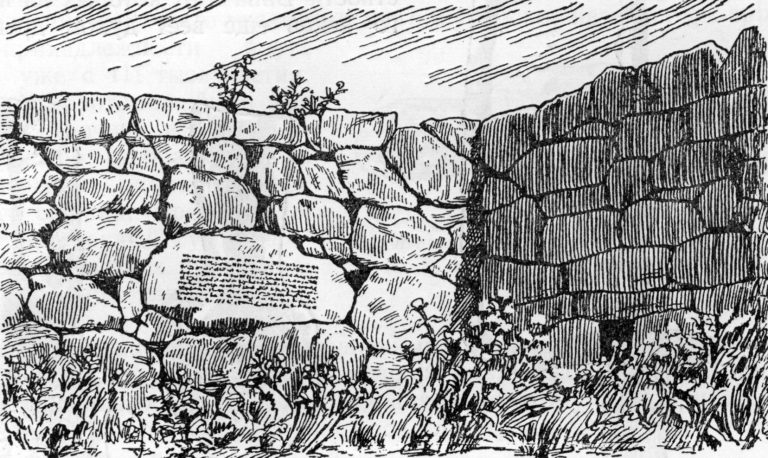
The width and height of the screenshot is (768, 458). In order to click on hole in wall in this screenshot , I will do `click(613, 344)`.